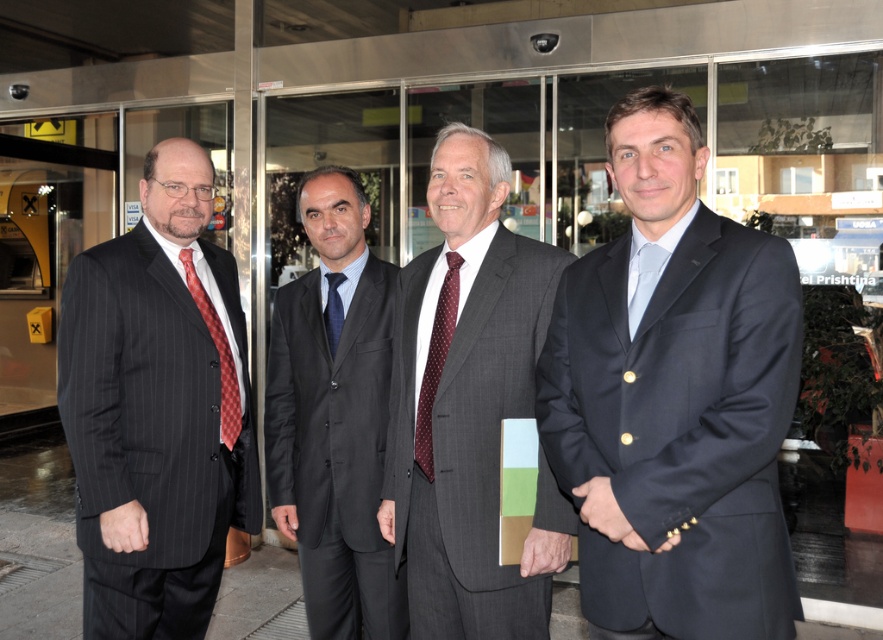
I want to click on matte black suit at left, so click(x=157, y=410).

Can you confirm if matte black suit at left is wider than dark gray suit at center?

No.

Who is more forward, [223,547] or [289,396]?

Point [223,547]

The image size is (883, 640). Identify the location of matte black suit at left. (157, 410).

Can you confirm if matte black suit at left is positioned to the right of blue silk tie at center?

Incorrect, matte black suit at left is not on the right side of blue silk tie at center.

Which of these two, matte black suit at left or blue silk tie at center, stands taller?

Standing taller between the two is matte black suit at left.

The width and height of the screenshot is (883, 640). Identify the location of matte black suit at left. [157, 410].

Between matte black suit at left and red checkered tie at left, which one has more height?

With more height is matte black suit at left.

Describe the element at coordinates (157, 410) in the screenshot. I see `matte black suit at left` at that location.

Does point (164, 252) come closer to viewer compared to point (210, 312)?

Yes, it is.

Image resolution: width=883 pixels, height=640 pixels. In order to click on matte black suit at left in this screenshot , I will do `click(157, 410)`.